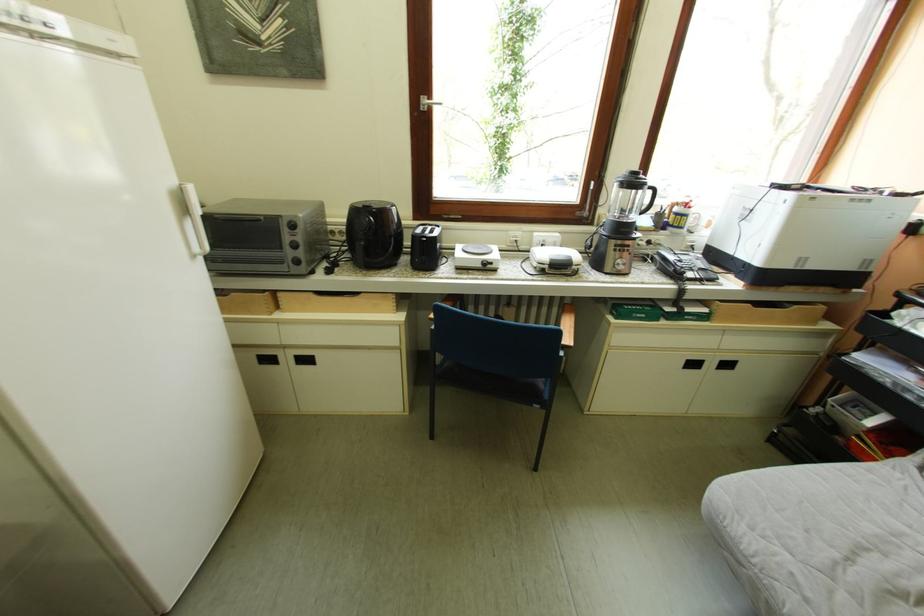
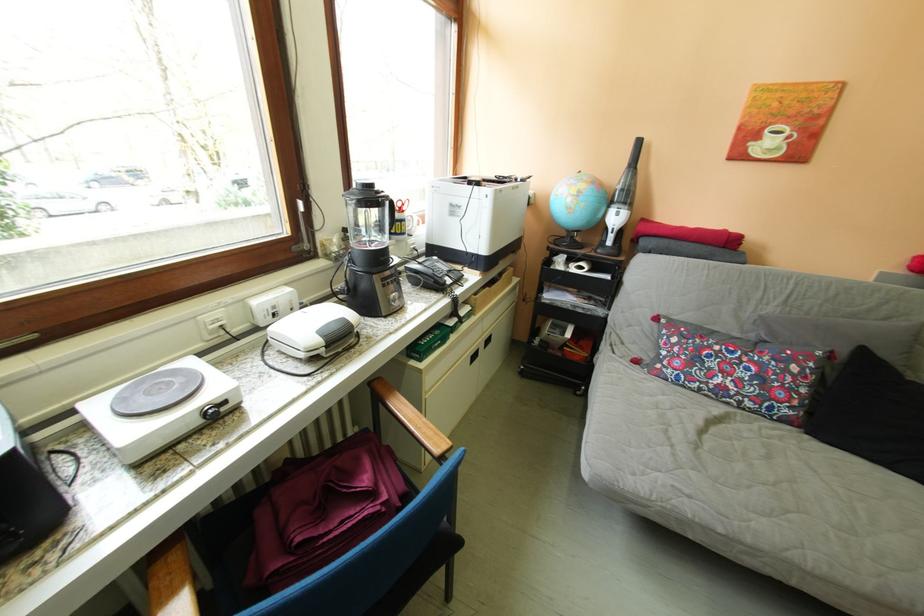
Where in the second image is the point corresponding to pixel 494 265 from the first image?

(216, 416)